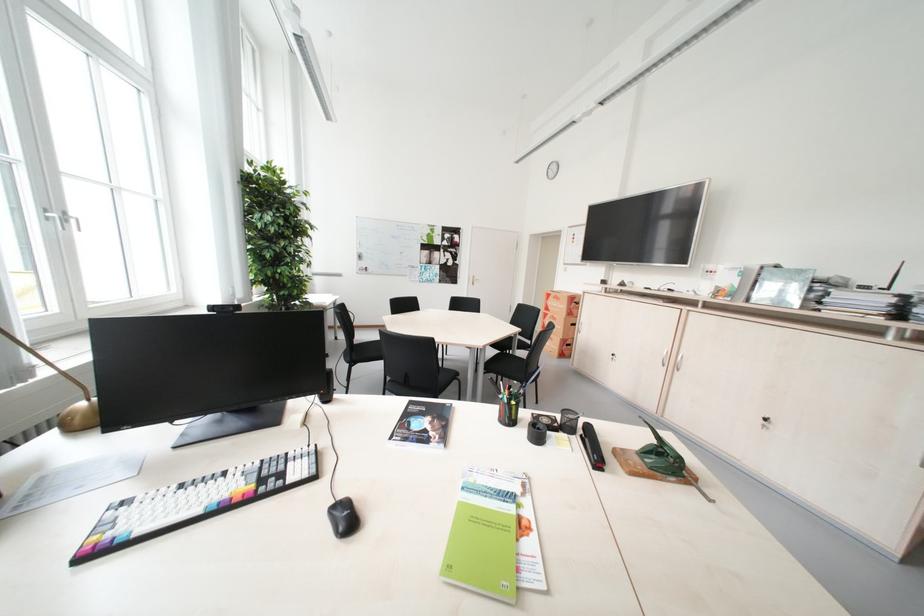
Locate an element on the screen. green press handle is located at coordinates (661, 456).